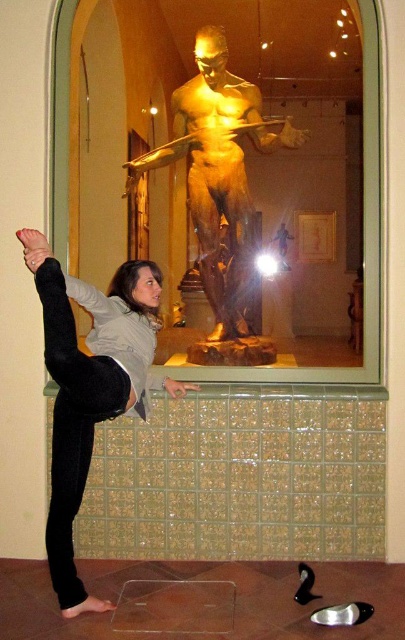
Based on the coordinates provided, where exactly is the matte black leggings at lower left located in the image?

The matte black leggings at lower left are located at the 2D coordinates point (x=81, y=396).

Consider the image. You are an artist trying to sketch the scene. You notice the matte black leggings at lower left and the gold polished statue at center. Which object should you draw first if you want to focus on the thinner details first?

You should draw the matte black leggings at lower left first because it is thinner than the gold polished statue at center.

You are standing in the museum and want to take a photo of both the point at coordinates (51, 332) and the point at coordinates (211, 193). Which point should you focus on first to ensure both are in clear view?

You should focus on point (51, 332) first because it is closer to you than point (211, 193), ensuring both points are in clear view.